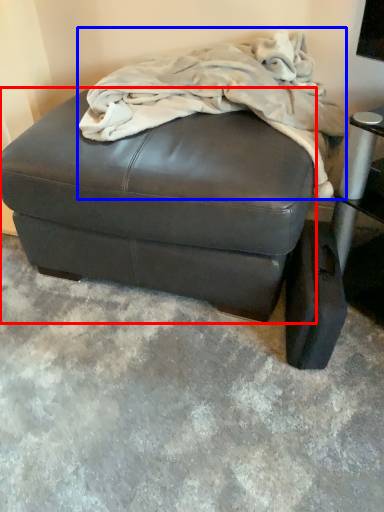
Question: Which object appears closest to the camera in this image, furniture (highlighted by a red box) or blanket (highlighted by a blue box)?

Choices:
 (A) furniture
 (B) blanket

Answer: (B)